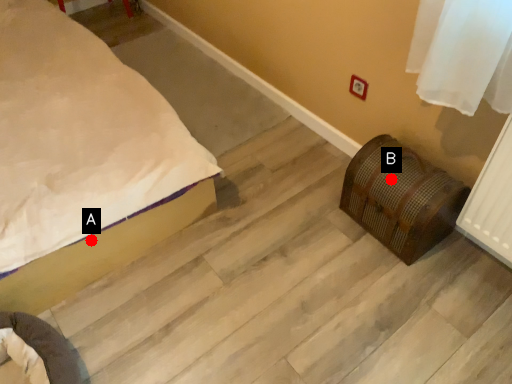
Question: Two points are circled on the image, labeled by A and B beside each circle. Which of the following is the closest to the observer?

Choices:
 (A) A is closer
 (B) B is closer

Answer: (A)